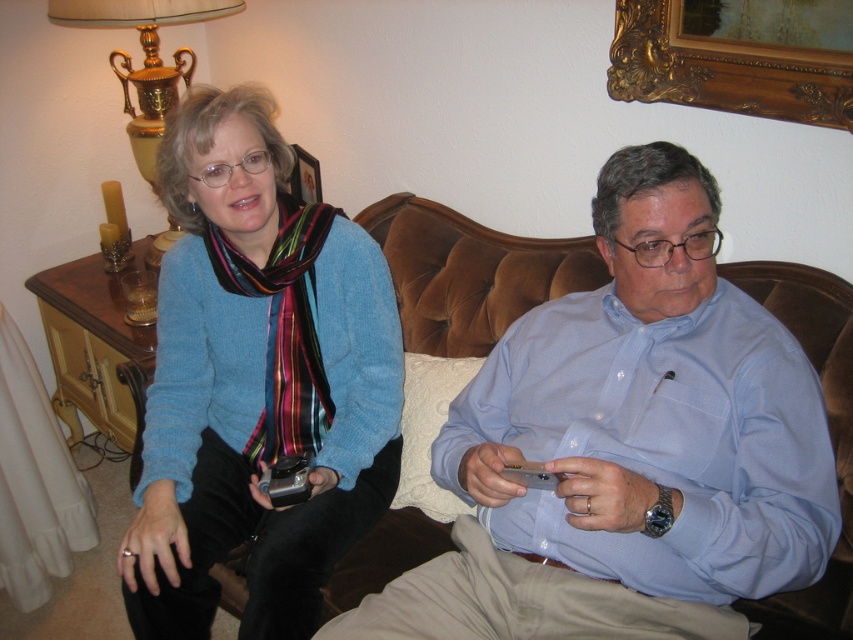
Question: Can you confirm if matte blue sweater at left is positioned to the left of wooden picture frame at upper center?

Choices:
 (A) no
 (B) yes

Answer: (A)

Question: Which of the following is the farthest from the observer?

Choices:
 (A) brown velvet couch at center
 (B) gold ornate picture frame at upper center
 (C) wooden picture frame at upper center

Answer: (C)

Question: Can you confirm if brown velvet couch at center is positioned to the right of gold metallic lamp at upper left?

Choices:
 (A) yes
 (B) no

Answer: (A)

Question: Can you confirm if matte blue sweater at left is smaller than gold ornate picture frame at upper center?

Choices:
 (A) no
 (B) yes

Answer: (A)

Question: Which is farther from the wooden picture frame at upper center?

Choices:
 (A) gold ornate picture frame at upper center
 (B) brown velvet couch at center

Answer: (A)

Question: Which of the following is the farthest from the observer?

Choices:
 (A) (48, 16)
 (B) (294, 182)

Answer: (B)